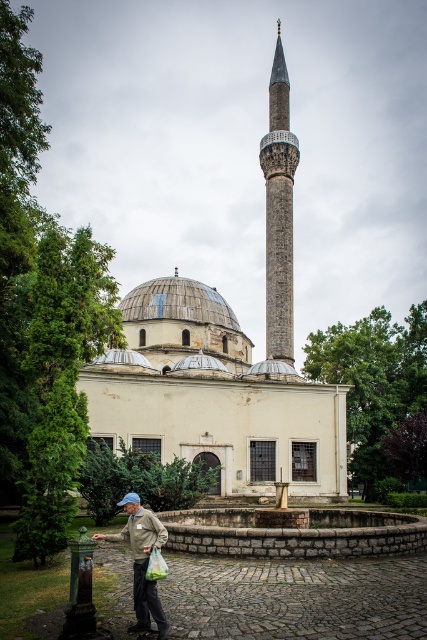
Question: Among these points, which one is nearest to the camera?

Choices:
 (A) (280, 99)
 (B) (137, 596)

Answer: (B)

Question: Which object is closer to the camera taking this photo?

Choices:
 (A) light brown fabric jacket at lower left
 (B) gray stone minaret at center

Answer: (A)

Question: Is gray stone minaret at center thinner than light brown fabric jacket at lower left?

Choices:
 (A) yes
 (B) no

Answer: (A)

Question: Which object appears closest to the camera in this image?

Choices:
 (A) light brown fabric jacket at lower left
 (B) gray stone minaret at center

Answer: (A)

Question: Can you confirm if gray stone minaret at center is smaller than light brown fabric jacket at lower left?

Choices:
 (A) no
 (B) yes

Answer: (A)

Question: Can you confirm if gray stone minaret at center is positioned above light brown fabric jacket at lower left?

Choices:
 (A) no
 (B) yes

Answer: (B)